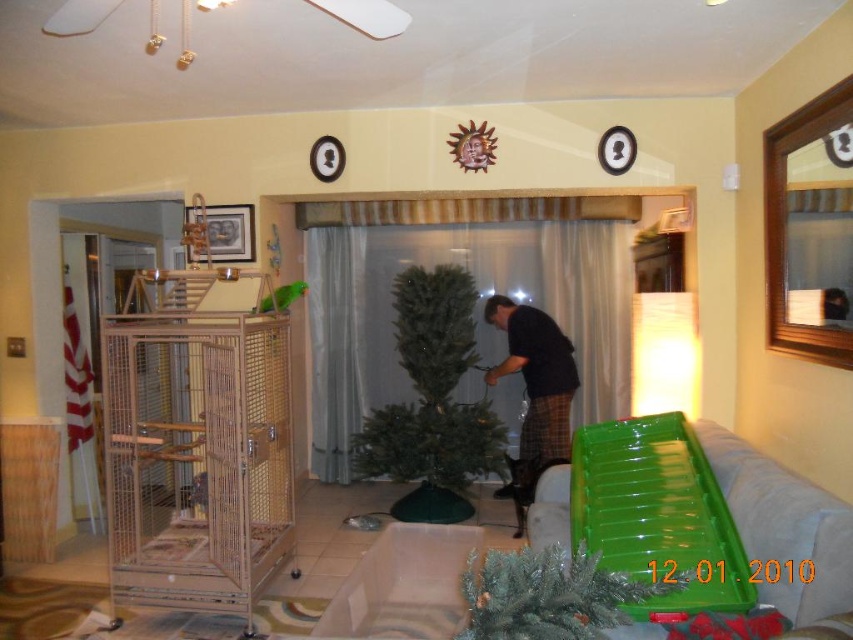
Find the location of a particular element. The image size is (853, 640). green matte christmas tree at center is located at coordinates (432, 403).

Does point (476, 464) lie in front of point (549, 337)?

Yes, point (476, 464) is in front of point (549, 337).

Describe the element at coordinates (432, 403) in the screenshot. I see `green matte christmas tree at center` at that location.

Find the location of `green matte christmas tree at center`. green matte christmas tree at center is located at coordinates (432, 403).

Who is taller, metal mesh birdcage at left or green artificial tree at center?

Standing taller between the two is metal mesh birdcage at left.

Between metal mesh birdcage at left and green artificial tree at center, which one appears on the right side from the viewer's perspective?

Positioned to the right is green artificial tree at center.

The height and width of the screenshot is (640, 853). In order to click on metal mesh birdcage at left in this screenshot , I will do `click(196, 458)`.

Locate an element on the screen. This screenshot has height=640, width=853. metal mesh birdcage at left is located at coordinates (196, 458).

Where is `green matte christmas tree at center`? Image resolution: width=853 pixels, height=640 pixels. green matte christmas tree at center is located at coordinates (432, 403).

Describe the element at coordinates (432, 403) in the screenshot. The image size is (853, 640). I see `green matte christmas tree at center` at that location.

Is point (482, 451) positioned before point (527, 580)?

No, (482, 451) is further to viewer.

What are the coordinates of `green matte christmas tree at center` in the screenshot? It's located at (432, 403).